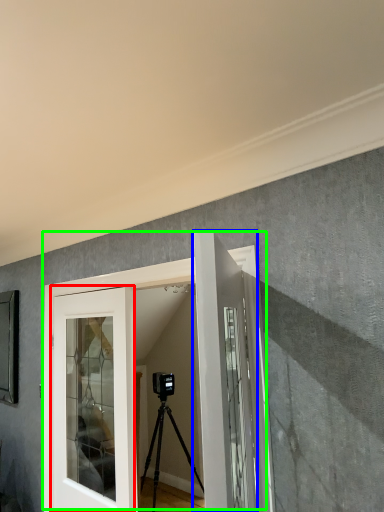
Question: Which is farther away from door (highlighted by a red box)? door (highlighted by a blue box) or door (highlighted by a green box)?

Choices:
 (A) door
 (B) door

Answer: (A)